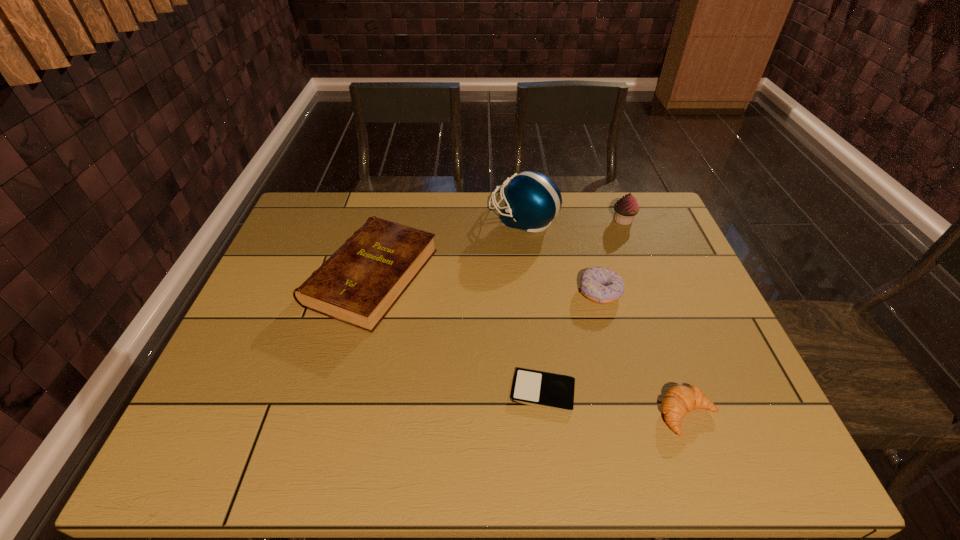
This screenshot has width=960, height=540. Identify the location of vacant space in between the second tallest object and the crescent roll. (656, 318).

This screenshot has width=960, height=540. What are the coordinates of `object identified as the closest to the third tallest object` in the screenshot? It's located at (532, 200).

Locate which object is the fourth closest to the doughnut. Please provide its 2D coordinates. Your answer should be formatted as a tuple, i.e. [(x, y)], where the tuple contains the x and y coordinates of a point satisfying the conditions above.

[(680, 399)]

Find the location of a particular element. The image size is (960, 540). free location that satisfies the following two spatial constraints: 1. on the front side of the crescent roll; 2. on the right side of the leftmost object is located at coordinates (336, 415).

Where is `blank area in the image that satisfies the following two spatial constraints: 1. at the front of the second tallest object with the faceguard; 2. on the right side of the tallest object`? The height and width of the screenshot is (540, 960). blank area in the image that satisfies the following two spatial constraints: 1. at the front of the second tallest object with the faceguard; 2. on the right side of the tallest object is located at coordinates (523, 220).

You are a GUI agent. You are given a task and a screenshot of the screen. Output one action in this format:
    pyautogui.click(x=<x>, y=<y>)
    Task: Click on the vacant region that satisfies the following two spatial constraints: 1. on the back side of the second tallest object; 2. on the left side of the doughnut
    
    Given the screenshot: What is the action you would take?
    pyautogui.click(x=581, y=220)

Find the location of a particular element. The image size is (960, 540). free space that satisfies the following two spatial constraints: 1. at the front of the tallest object with the faceguard; 2. on the back side of the crescent roll is located at coordinates (546, 415).

Identify the location of vacant space that satisfies the following two spatial constraints: 1. on the back side of the fifth shortest object; 2. on the left side of the crescent roll. (616, 220).

Locate an element on the screen. The width and height of the screenshot is (960, 540). free space that satisfies the following two spatial constraints: 1. at the front of the football helmet with the faceguard; 2. on the back side of the crescent roll is located at coordinates (546, 415).